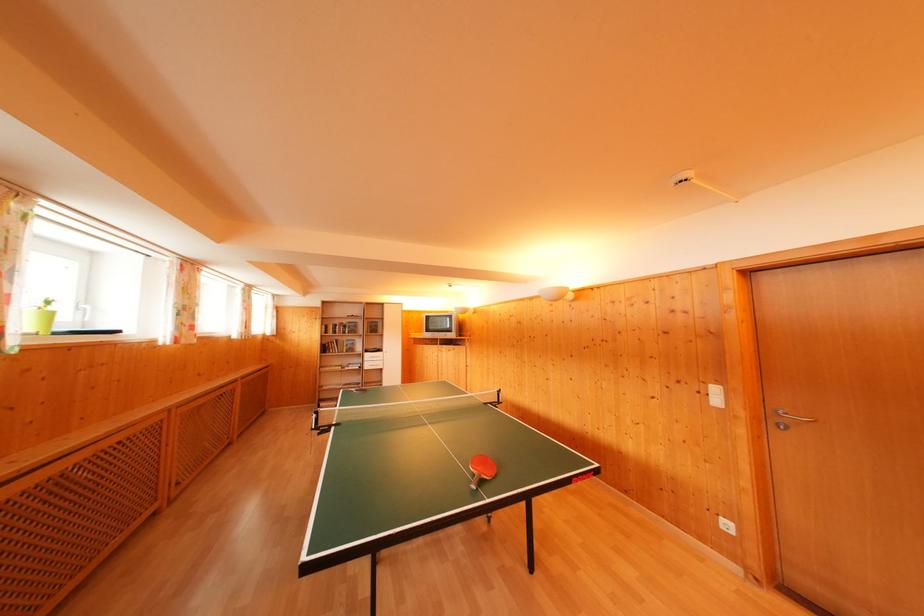
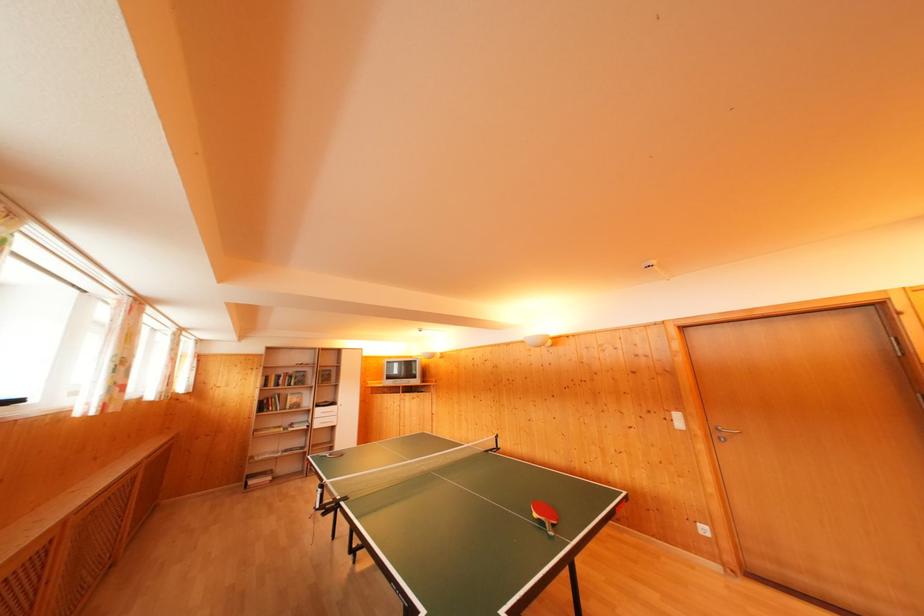
Question: The camera is either moving clockwise (left) or counter-clockwise (right) around the object. The first image is from the beginning of the video and the second image is from the end. Is the camera moving left or right when shooting the video?

Choices:
 (A) Left
 (B) Right

Answer: (A)